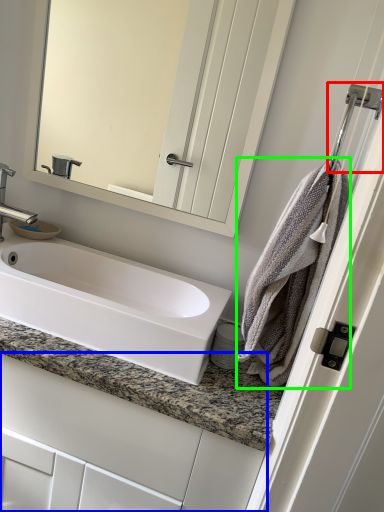
Question: Based on their relative distances, which object is farther from shower (highlighted by a red box)? Choose from bathroom cabinet (highlighted by a blue box) and bath towel (highlighted by a green box).

Choices:
 (A) bathroom cabinet
 (B) bath towel

Answer: (A)